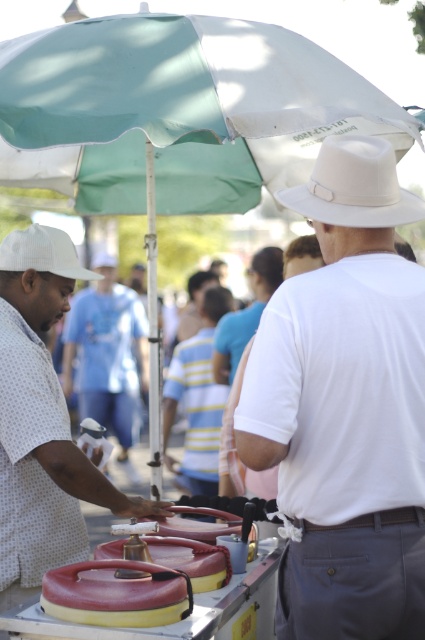
You are a photographer standing at the back of the market. You want to take a photo of the white matte shirt at center and the white fabric cowboy hat at left. However, there is a tall plant blocking your view. Based on their heights, which one is more likely to be visible above the plant?

The white matte shirt at center is much taller than the white fabric cowboy hat at left, so the white matte shirt at center is more likely to be visible above the plant.

You are standing at the food stall under the green and white umbrella. You see two points marked in the scene. The first point is at coordinates point (56, 464) and the second is at point (36, 240). If you were to walk from the first point to the second point, would you be moving towards the front or the back of the scene?

Since point (56, 464) is in front of point (36, 240), moving from the first point to the second point would mean moving towards the back of the scene.

You are standing at the center of the image and want to locate the white matte hat at upper center. According to the coordinates provided, in which direction should you look to find it?

The white matte hat at upper center is located at coordinates point (345, 406). Since the coordinates are based on a grid where (0, 0) is the bottom left corner, the hat is positioned to the right and above the center point. Therefore, you should look towards the upper right direction from the center to locate it.